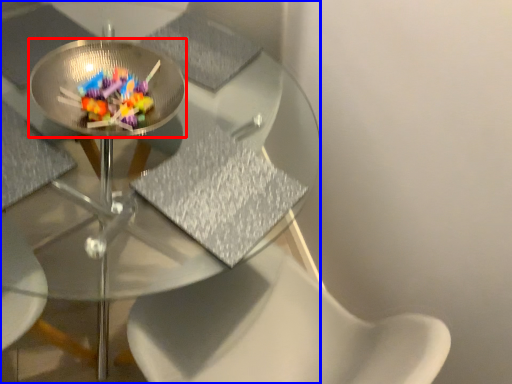
Question: Which point is further to the camera, glass plate (highlighted by a red box) or table (highlighted by a blue box)?

Choices:
 (A) glass plate
 (B) table

Answer: (A)